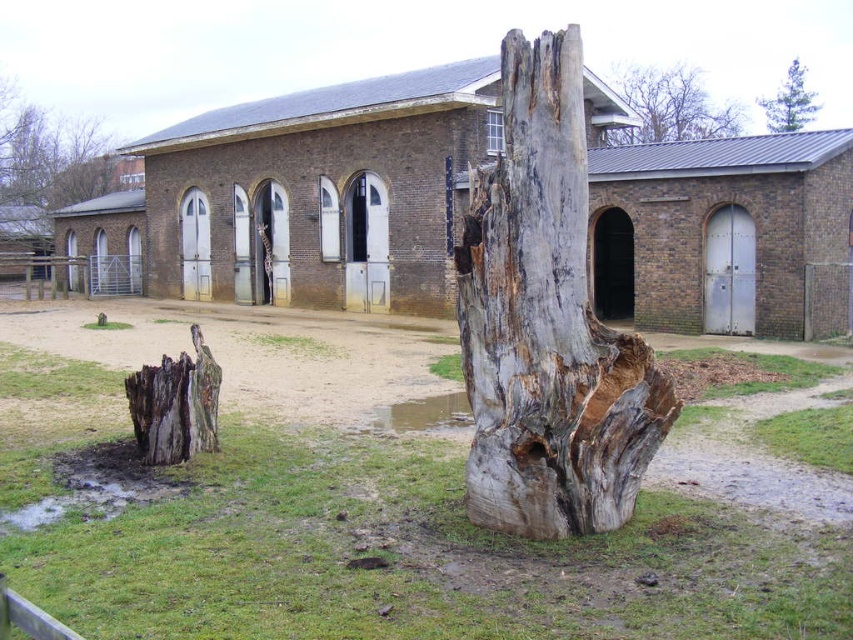
Does brown brick building at center come behind green textured pine tree at upper right?

No, brown brick building at center is closer to the viewer.

Is point (480, 152) positioned after point (761, 108)?

No, (480, 152) is in front of (761, 108).

What are the coordinates of `brown brick building at center` in the screenshot? It's located at (303, 196).

Who is more forward, (480, 262) or (801, 120)?

Point (480, 262)

Can you confirm if weathered wood tree trunk at center is taller than green textured pine tree at upper right?

In fact, weathered wood tree trunk at center may be shorter than green textured pine tree at upper right.

Measure the distance between weathered wood tree trunk at center and camera.

A distance of 5.33 meters exists between weathered wood tree trunk at center and camera.

Find the location of a particular element. The image size is (853, 640). weathered wood tree trunk at center is located at coordinates (547, 323).

Based on the photo, can you confirm if brown brick building at center is shorter than gray rough bark tree stump at upper center?

Yes.

Does brown brick building at center have a larger size compared to gray rough bark tree stump at upper center?

Incorrect, brown brick building at center is not larger than gray rough bark tree stump at upper center.

Is point (445, 77) positioned after point (654, 141)?

No, it is not.

Where is `brown brick building at center`? brown brick building at center is located at coordinates (303, 196).